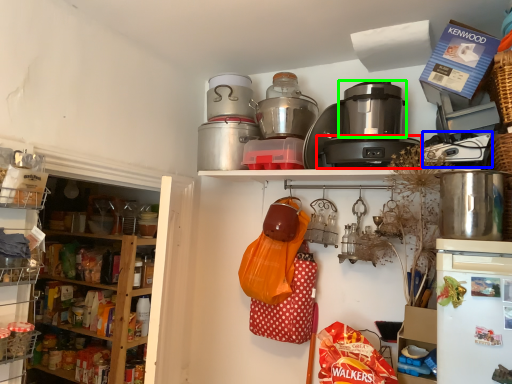
Question: Which object is positioned farthest from appliance (highlighted by a red box)? Select from appliance (highlighted by a blue box) and rice cooker (highlighted by a green box).

Choices:
 (A) appliance
 (B) rice cooker

Answer: (A)